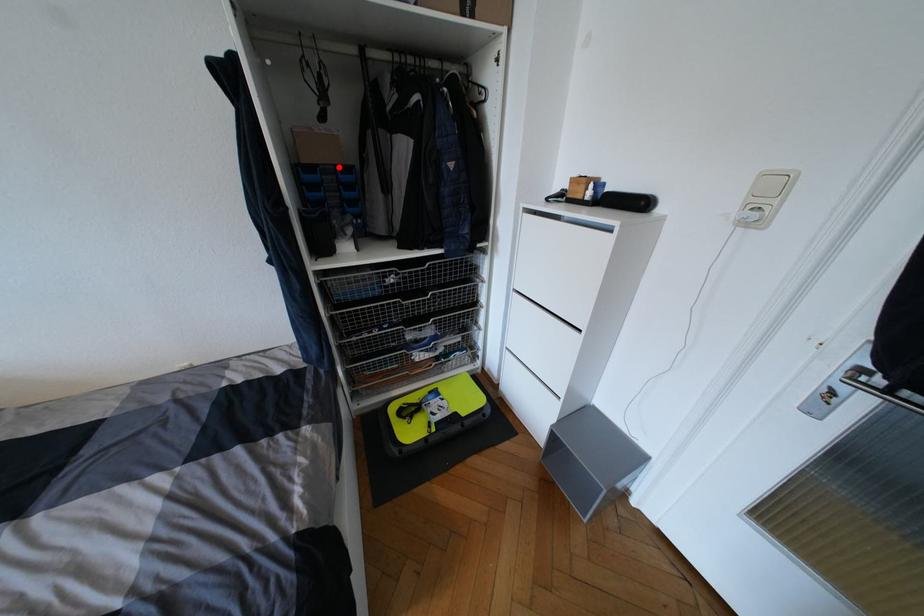
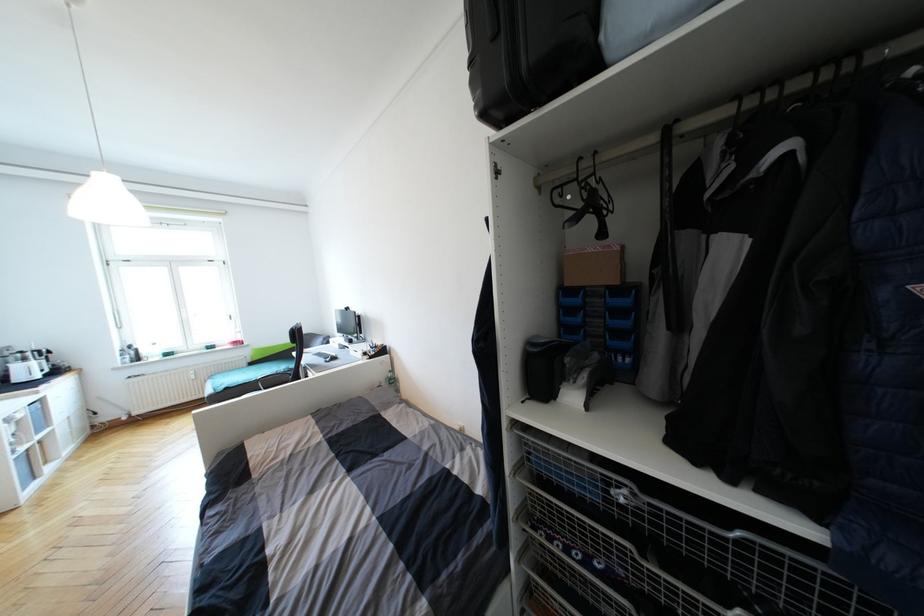
Find the pixel in the second image that matches the highlighted location in the first image.

(611, 288)